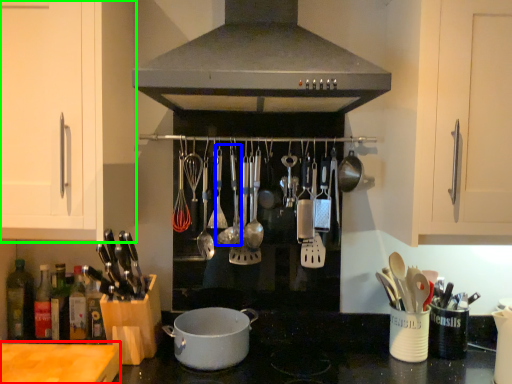
Question: Based on their relative distances, which object is nearer to counter top (highlighted by a red box)? Choose from utensil (highlighted by a blue box) and cabinetry (highlighted by a green box).

Choices:
 (A) utensil
 (B) cabinetry

Answer: (B)